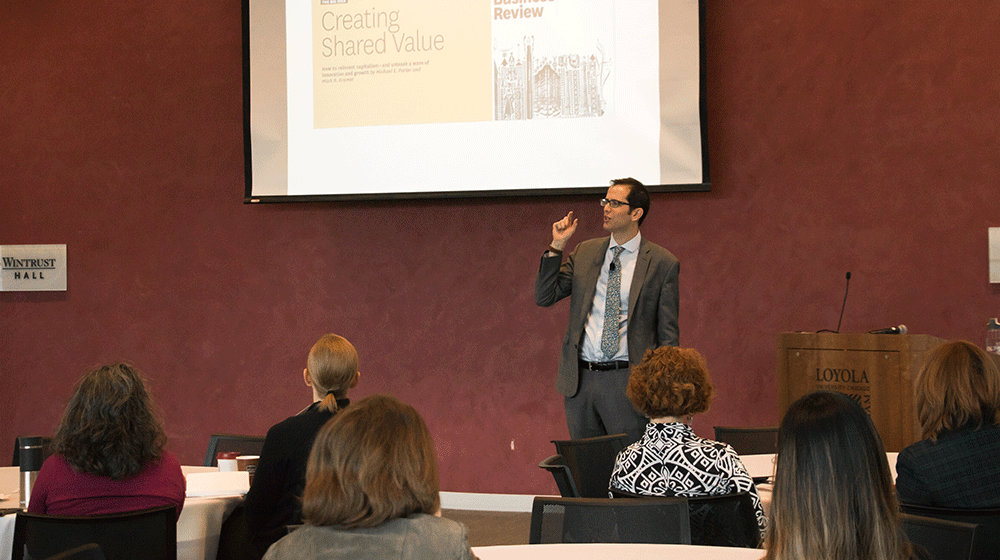
This screenshot has height=560, width=1000. I want to click on first slide on projector screen, so click(457, 57).